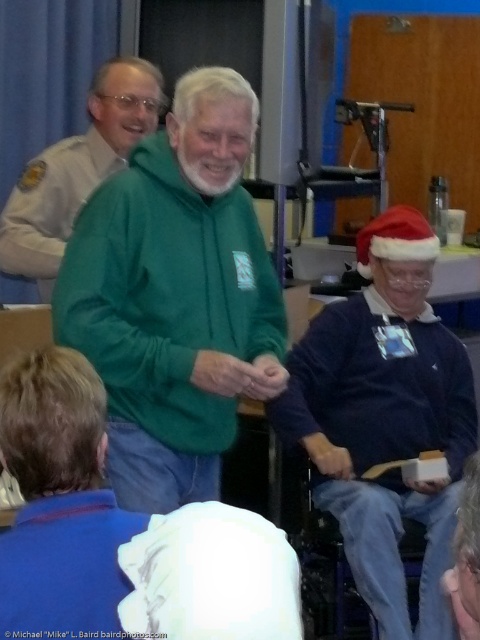
Locate an element on the screen. This screenshot has width=480, height=640. green fleece jacket at center is located at coordinates (176, 296).

From the picture: Does green fleece jacket at center have a greater width compared to blue sweater at lower right?

No, green fleece jacket at center is not wider than blue sweater at lower right.

The width and height of the screenshot is (480, 640). Find the location of `green fleece jacket at center`. green fleece jacket at center is located at coordinates (176, 296).

Where is `green fleece jacket at center`? green fleece jacket at center is located at coordinates (176, 296).

Can you confirm if green fleece jacket at center is wider than green fleece at center?

Indeed, green fleece jacket at center has a greater width compared to green fleece at center.

Between point (199, 305) and point (109, 104), which one is positioned in front?

Point (199, 305)

This screenshot has height=640, width=480. Identify the location of green fleece jacket at center. (176, 296).

From the picture: Which of these two, blue sweater at lower right or green fleece at center, stands taller?

blue sweater at lower right is taller.

Is blue sweater at lower right smaller than green fleece at center?

Actually, blue sweater at lower right might be larger than green fleece at center.

Between point (324, 365) and point (24, 189), which one is positioned behind?

The point (24, 189) is more distant.

The width and height of the screenshot is (480, 640). I want to click on blue sweater at lower right, so click(384, 419).